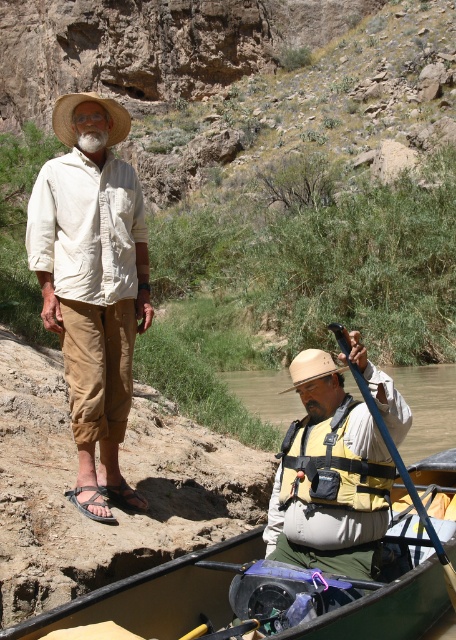
Question: Is yellow fabric life jacket at lower center thinner than straw woven cowboy hat at upper left?

Choices:
 (A) no
 (B) yes

Answer: (B)

Question: Is matte khaki pants at left thinner than blue plastic paddle at lower center?

Choices:
 (A) no
 (B) yes

Answer: (B)

Question: Which point is farther from the camera taking this photo?

Choices:
 (A) (291, 547)
 (B) (60, 100)

Answer: (B)

Question: Which point appears closest to the camera in this image?

Choices:
 (A) click(294, 378)
 (B) click(362, 490)

Answer: (B)

Question: Which point appears farthest from the camera in this image?

Choices:
 (A) (393, 600)
 (B) (66, 248)

Answer: (B)

Question: Does yellow life vest at center appear under blue plastic paddle at lower center?

Choices:
 (A) no
 (B) yes

Answer: (B)